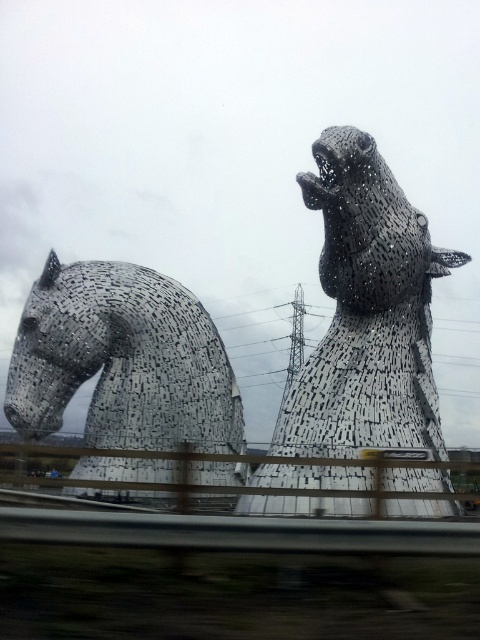
Who is higher up, black textured horse at upper center or black textured horse at left?

black textured horse at upper center is above.

Which is in front, point (385, 339) or point (101, 292)?

Point (385, 339) is more forward.

Identify the location of black textured horse at upper center. The height and width of the screenshot is (640, 480). (367, 312).